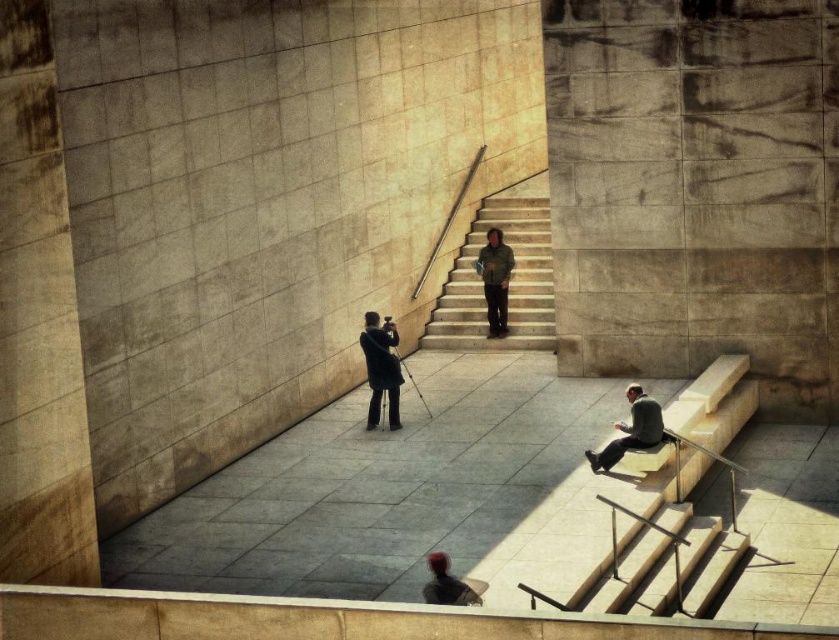
Which is more to the left, smooth concrete pillar at left or matte black camera at center?

From the viewer's perspective, smooth concrete pillar at left appears more on the left side.

At what (x,y) coordinates should I click in order to perform the action: click on smooth concrete pillar at left. Please return your answer as a coordinate pair (x, y). Looking at the image, I should click on (38, 324).

Who is more distant from viewer, [4,106] or [391,408]?

Point [391,408]

Where is `smooth concrete pillar at left`? The image size is (839, 640). smooth concrete pillar at left is located at coordinates (38, 324).

From the picture: Does smooth concrete stairs at center appear on the left side of shiny black hair at lower center?

Incorrect, smooth concrete stairs at center is not on the left side of shiny black hair at lower center.

Does smooth concrete stairs at center have a larger size compared to shiny black hair at lower center?

Indeed, smooth concrete stairs at center has a larger size compared to shiny black hair at lower center.

Find the location of a particular element. smooth concrete stairs at center is located at coordinates (509, 280).

I want to click on smooth concrete stairs at center, so pos(509,280).

Can you confirm if green textured jacket at center is thinner than shiny black hair at lower center?

Incorrect, green textured jacket at center's width is not less than shiny black hair at lower center's.

At what (x,y) coordinates should I click in order to perform the action: click on green textured jacket at center. Please return your answer as a coordinate pair (x, y). This screenshot has height=640, width=839. Looking at the image, I should click on (494, 280).